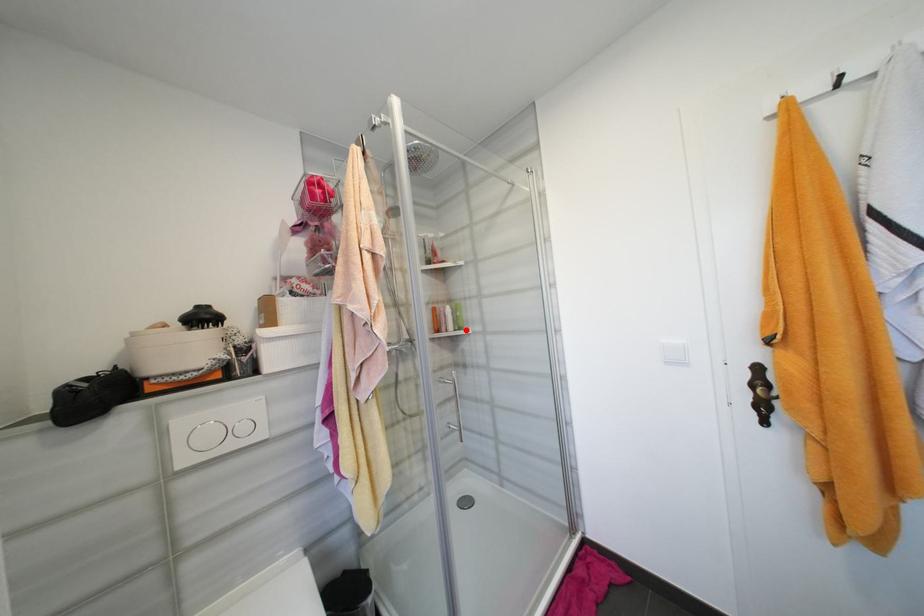
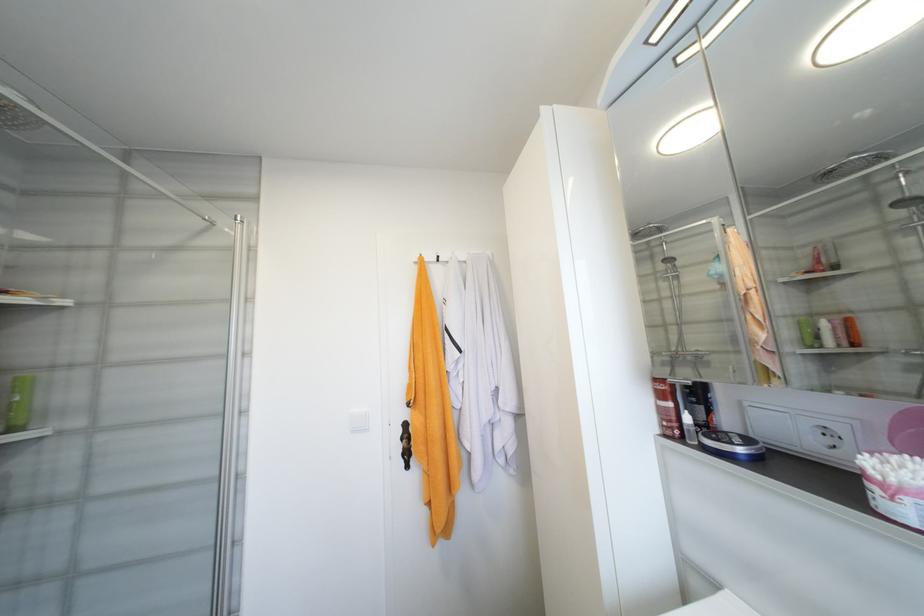
Question: I am providing you with two images of the same scene from different viewpoints. Given a red point in image1, look at the same physical point in image2. Is it:

Choices:
 (A) Closer to the viewpoint
 (B) Farther from the viewpoint

Answer: (A)